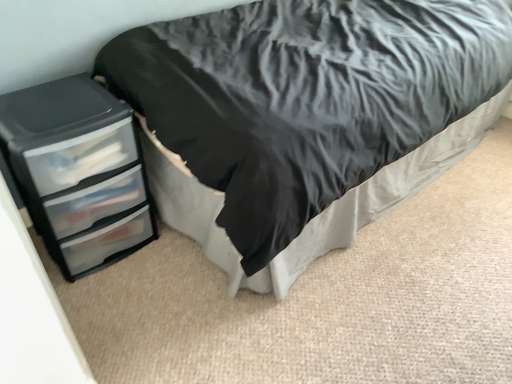
In order to click on free point above black plastic chest of drawers at left (from a real-world perspective) in this screenshot , I will do `click(50, 107)`.